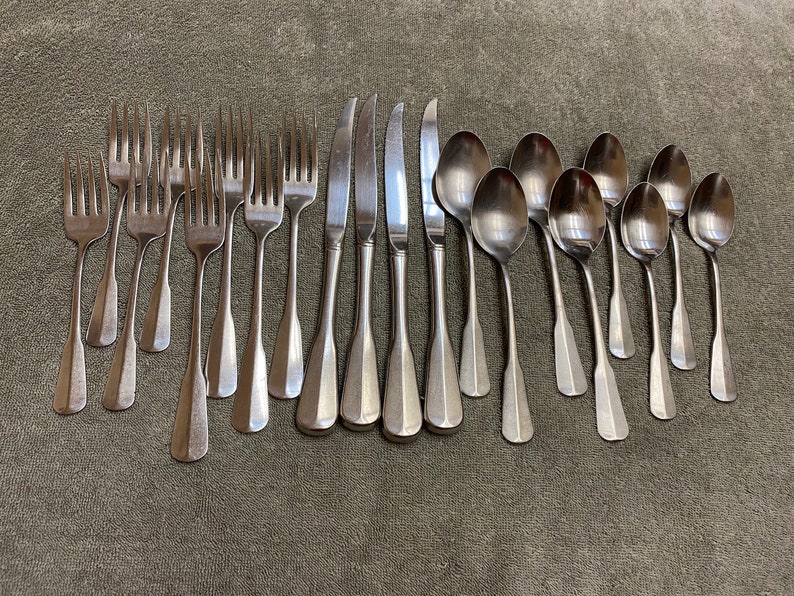
The height and width of the screenshot is (596, 794). I want to click on spoon, so click(707, 178), click(684, 173), click(648, 210), click(614, 172), click(577, 209), click(537, 149), click(503, 198), click(480, 166).